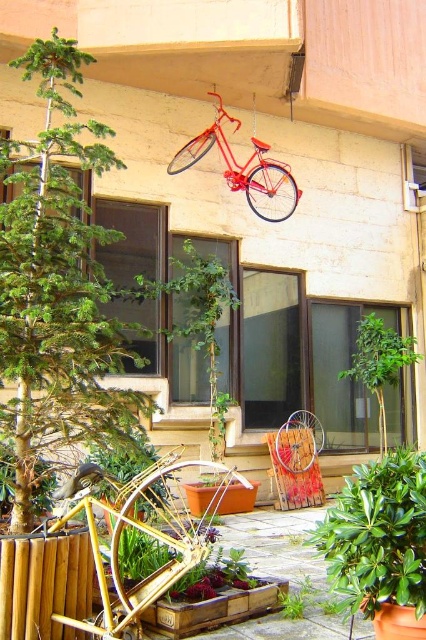
Which is behind, point (112, 483) or point (337, 561)?

The point (112, 483) is behind.

Based on the photo, who is more distant from viewer, (129,538) or (360,532)?

The point (129,538) is more distant.

Find the location of a particular element. gold metallic bicycle at lower left is located at coordinates (144, 538).

Does gold metallic bicycle at lower left have a lesser height compared to shiny red bicycle at upper center?

Yes.

Is the position of gold metallic bicycle at lower left more distant than that of shiny red bicycle at upper center?

No.

Is point (175, 538) farther from camera compared to point (259, 154)?

No, it is in front of (259, 154).

Locate an element on the screen. The height and width of the screenshot is (640, 426). gold metallic bicycle at lower left is located at coordinates (144, 538).

Between gold metallic bicycle at lower left and green matte bicycle at lower left, which one is positioned lower?

gold metallic bicycle at lower left is lower down.

Can you confirm if gold metallic bicycle at lower left is taller than green matte bicycle at lower left?

No.

Is point (91, 538) behind point (123, 464)?

No.

Where is `gold metallic bicycle at lower left`? The height and width of the screenshot is (640, 426). gold metallic bicycle at lower left is located at coordinates (144, 538).